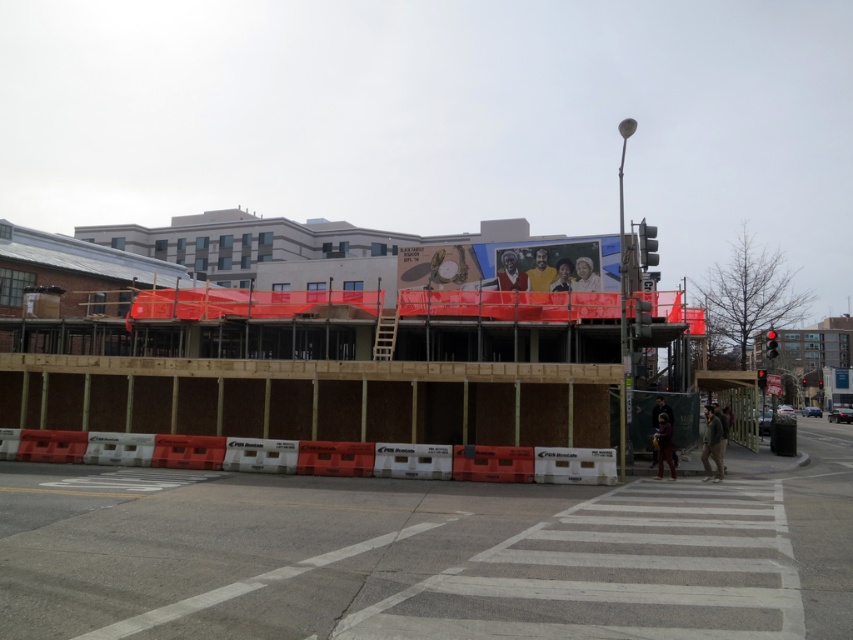
Is point (614, 472) positioned in front of point (772, 348)?

Yes.

Looking at this image, who is more distant from viewer, (115, 461) or (773, 332)?

Positioned behind is point (773, 332).

Between point (321, 474) and point (766, 336), which one is positioned in front?

Point (321, 474) is in front.

You are a GUI agent. You are given a task and a screenshot of the screen. Output one action in this format:
    pyautogui.click(x=<x>, y=<y>)
    Task: Click on the white plastic barricade at lower center
    The height and width of the screenshot is (640, 853).
    Given the screenshot: What is the action you would take?
    pyautogui.click(x=312, y=456)

Is white plastic barricade at lower center to the left of red glass traffic light at center from the viewer's perspective?

Correct, you'll find white plastic barricade at lower center to the left of red glass traffic light at center.

Can you confirm if white plastic barricade at lower center is bigger than red glass traffic light at center?

Yes, white plastic barricade at lower center is bigger than red glass traffic light at center.

Who is more distant from viewer, (325,442) or (762,385)?

The point (762,385) is more distant.

The height and width of the screenshot is (640, 853). Find the location of `white plastic barricade at lower center`. white plastic barricade at lower center is located at coordinates (312, 456).

Between red glass traffic light at upper right and red glass traffic light at center, which one has more height?

Standing taller between the two is red glass traffic light at upper right.

Describe the element at coordinates (770, 344) in the screenshot. The image size is (853, 640). I see `red glass traffic light at upper right` at that location.

Which is behind, point (766, 355) or point (763, 369)?

Positioned behind is point (763, 369).

Image resolution: width=853 pixels, height=640 pixels. Find the location of `red glass traffic light at upper right`. red glass traffic light at upper right is located at coordinates (770, 344).